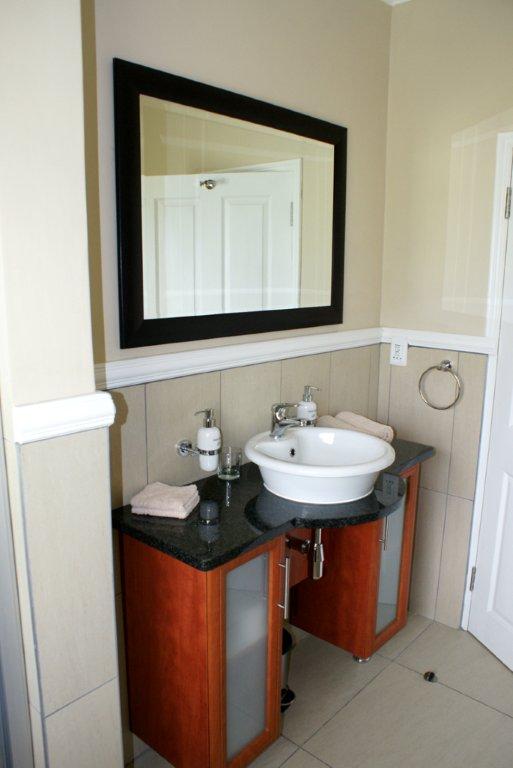
Where is `door`? The image size is (513, 768). door is located at coordinates (235, 667).